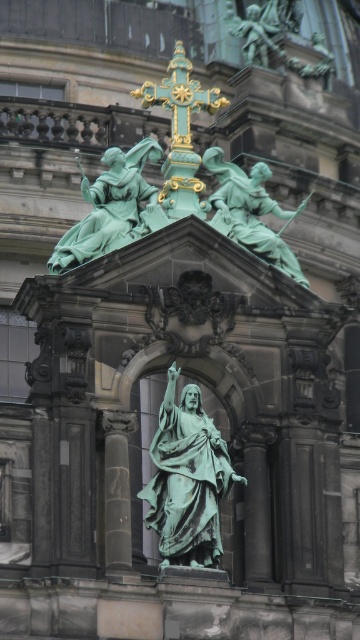
Question: Which of the following is the closest to the observer?

Choices:
 (A) green patinated bronze statue at upper left
 (B) green patina statue at center

Answer: (B)

Question: Which of the following is the closest to the observer?

Choices:
 (A) (102, 230)
 (B) (173, 131)
 (C) (223, 195)

Answer: (A)

Question: Is green patina statue at center bigger than goldmetalliccross at upper center?

Choices:
 (A) yes
 (B) no

Answer: (B)

Question: Does green patina statue at center appear on the right side of goldmetalliccross at upper center?

Choices:
 (A) yes
 (B) no

Answer: (A)

Question: Can you confirm if green patina statue at center is wider than green patinated statue at upper center?

Choices:
 (A) no
 (B) yes

Answer: (A)

Question: Considering the real-world distances, which object is farthest from the green patina statue at center?

Choices:
 (A) green patinated statue at upper center
 (B) goldmetalliccross at upper center
 (C) green patinated bronze statue at upper left

Answer: (B)